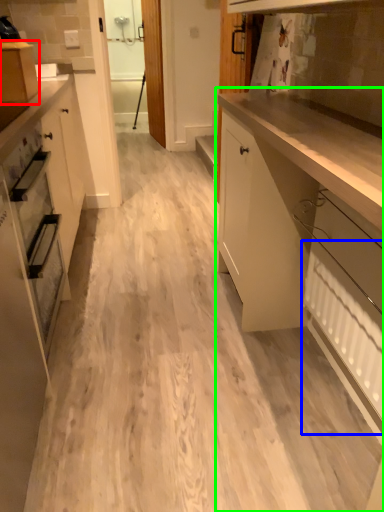
Question: Which object is positioned closest to cabinetry (highlighted by a red box)? Select from radiator (highlighted by a blue box) and cabinetry (highlighted by a green box).

Choices:
 (A) radiator
 (B) cabinetry

Answer: (B)